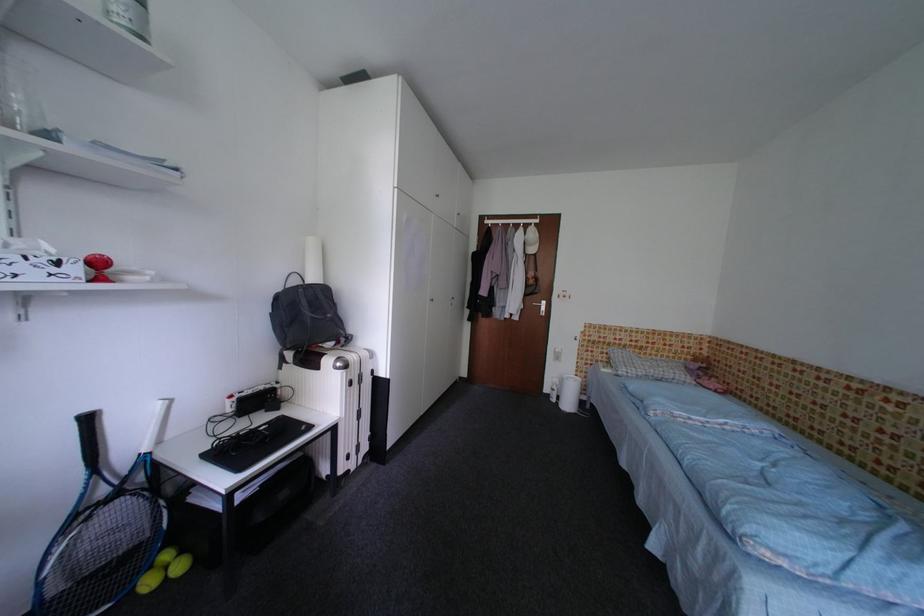
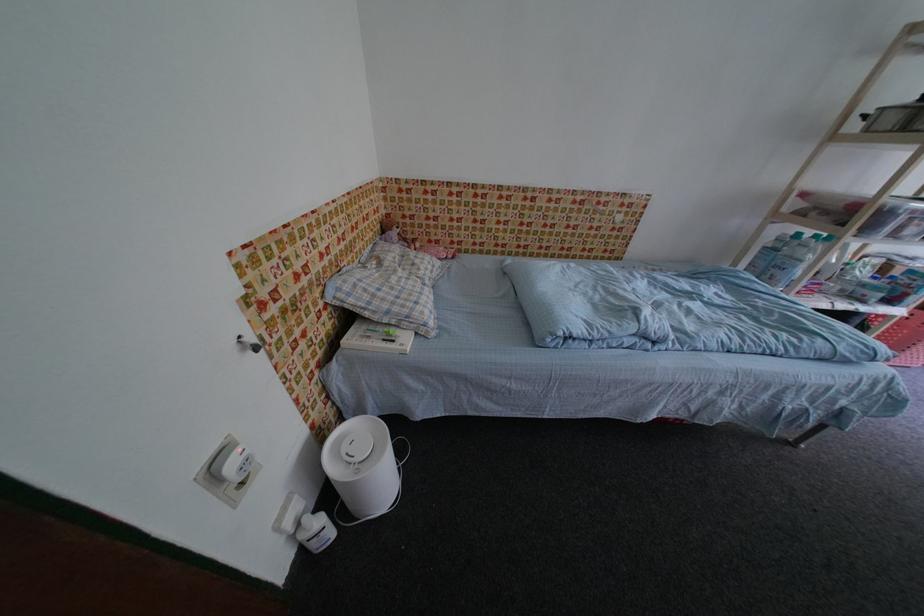
Locate, in the second image, the point that corresponds to [662,355] in the first image.

(370, 246)